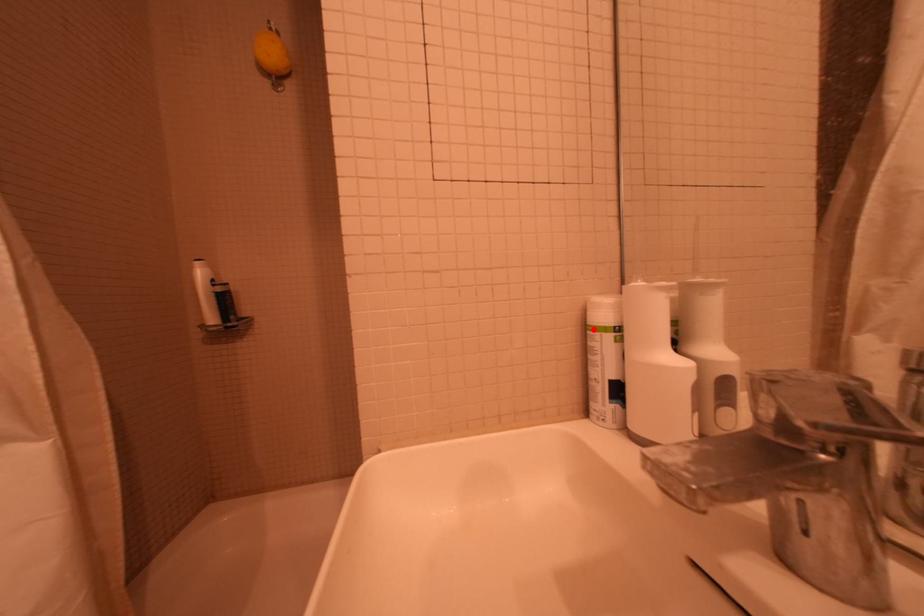
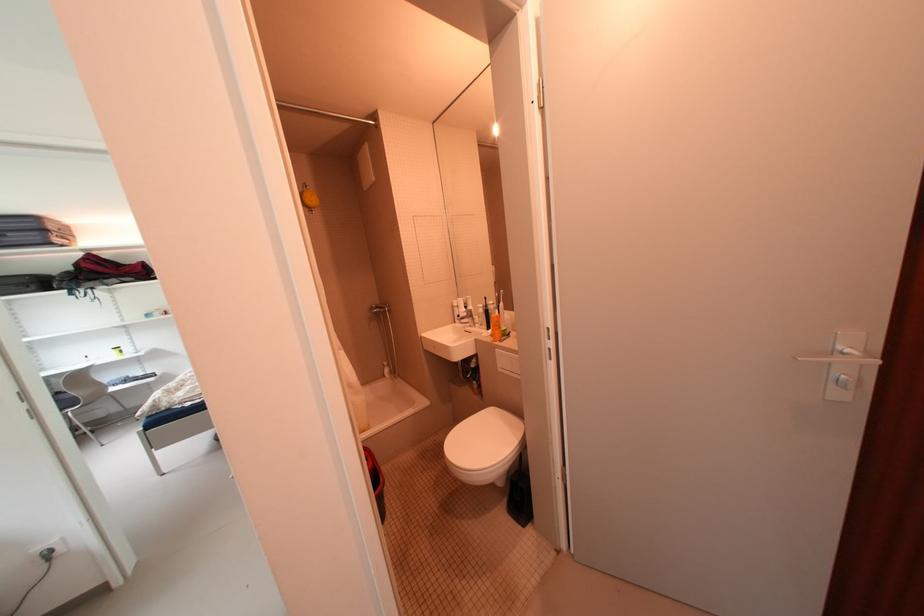
Locate, in the second image, the point that corresponds to the highlighted location in the first image.

(460, 308)